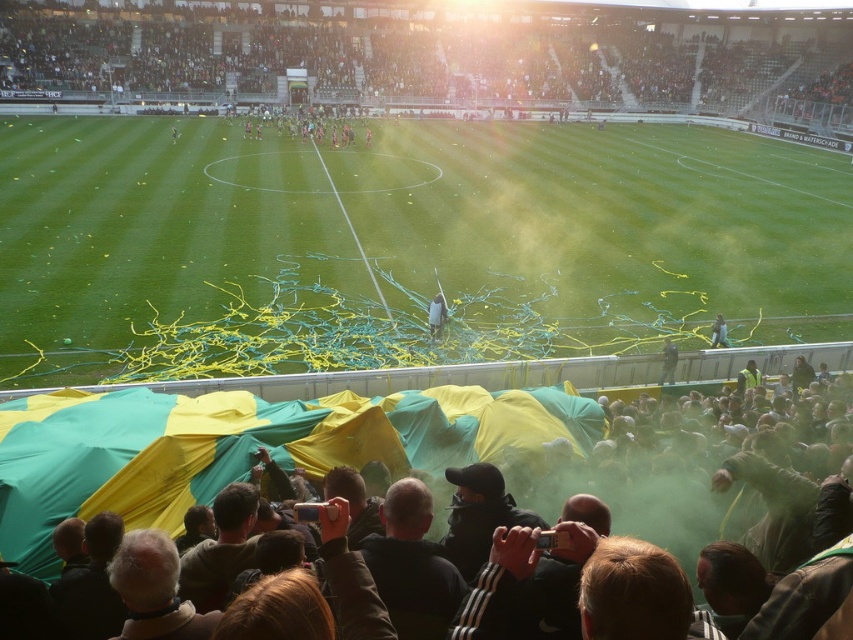
Can you confirm if yellow-green fabric at lower center is thinner than dark blue jacket at center?

No, yellow-green fabric at lower center is not thinner than dark blue jacket at center.

Is the position of yellow-green fabric at lower center more distant than that of dark blue jacket at center?

No, it is in front of dark blue jacket at center.

Which is behind, point (445, 392) or point (718, 317)?

The point (718, 317) is behind.

Find the location of a particular element. The image size is (853, 640). yellow-green fabric at lower center is located at coordinates (500, 458).

Is green fabric crowd at upper center shorter than yellow-green fabric at lower center?

No, green fabric crowd at upper center is not shorter than yellow-green fabric at lower center.

Can you confirm if green fabric crowd at upper center is taller than yellow-green fabric at lower center?

Indeed, green fabric crowd at upper center has a greater height compared to yellow-green fabric at lower center.

Is point (201, 97) in front of point (144, 438)?

No, it is not.

At what (x,y) coordinates should I click in order to perform the action: click on green fabric crowd at upper center. Please return your answer as a coordinate pair (x, y). Looking at the image, I should click on [437, 54].

Can you confirm if green grass at center is taller than dark gray jacket at center?

Correct, green grass at center is much taller as dark gray jacket at center.

Can you confirm if green grass at center is wider than dark gray jacket at center?

Indeed, green grass at center has a greater width compared to dark gray jacket at center.

Locate an element on the screen. The height and width of the screenshot is (640, 853). green grass at center is located at coordinates (403, 244).